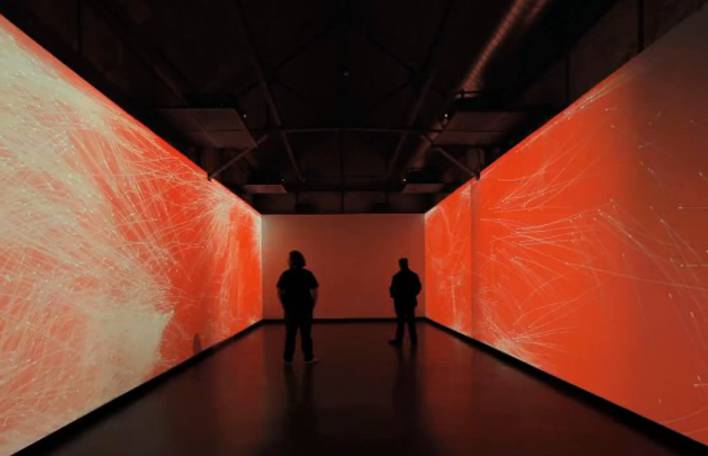
In order to click on vents in this screenshot , I will do `click(275, 190)`, `click(422, 193)`.